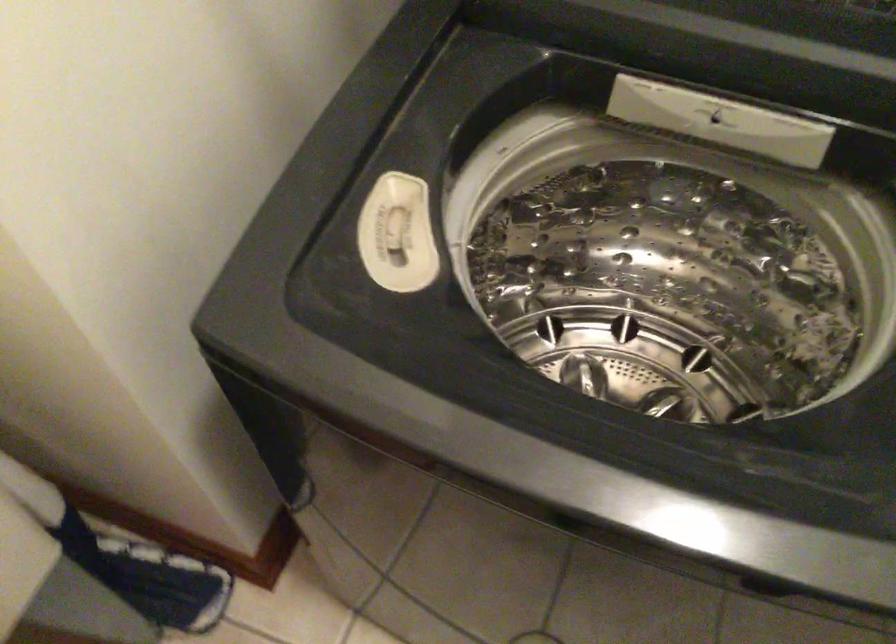
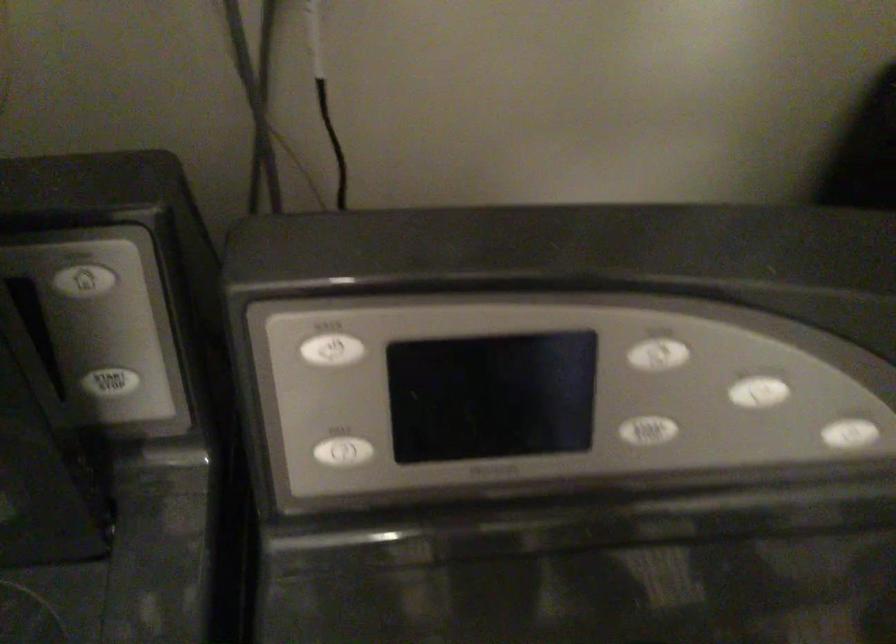
Question: The images are taken continuously from a first-person perspective. In which direction is your viewpoint rotating?

Choices:
 (A) Left
 (B) Right
 (C) Up
 (D) Down

Answer: (B)